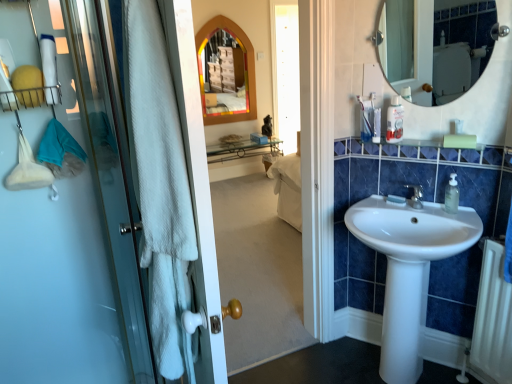
Identify the location of vacant space underneath white glossy mirror at upper right (from a real-world perspective). (428, 138).